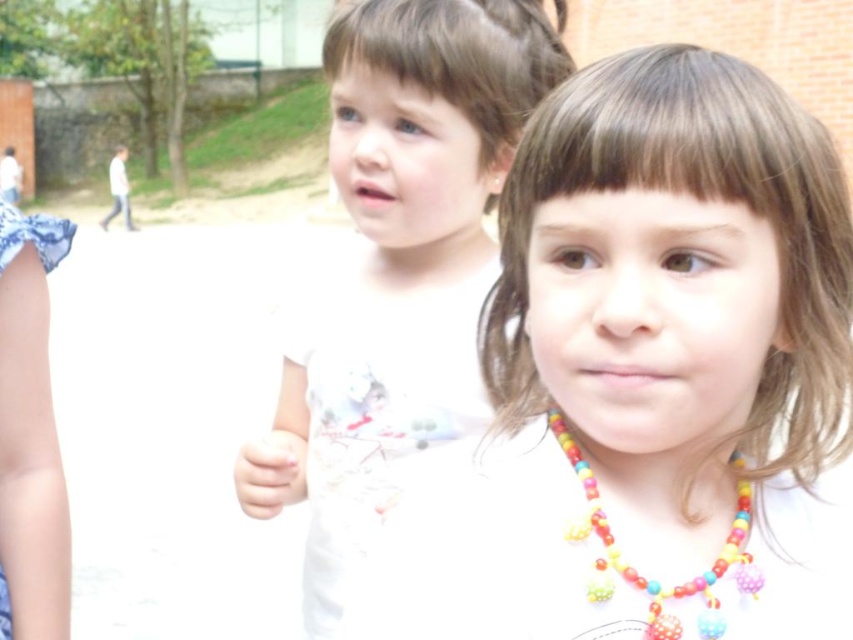
You are a photographer trying to capture a closeup of the multicolored beaded necklace at center and the white matte shirt at center. Since both are at the center, which one is closer to the left side of the frame?

The white matte shirt at center is positioned on the left side of multicolored beaded necklace at center, so the white matte shirt at center is closer to the left side of the frame.

You are a photographer trying to capture a closeup shot of the white matte necklace at center and the white matte hand at center. Since the camera can only focus on one object at a time, which object should you focus on to ensure it appears clearer in the photo?

The white matte necklace at center is larger in size than the white matte hand at center, so focusing on the white matte necklace at center would ensure it appears clearer in the photo.